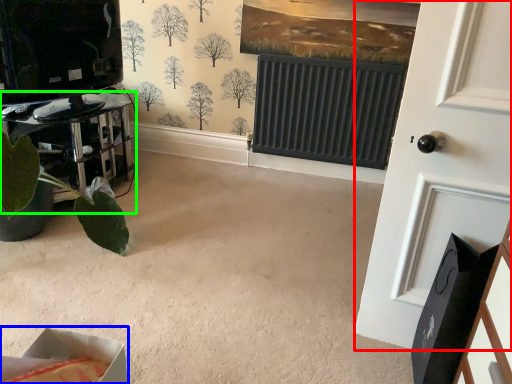
Question: Which is nearer to the door (highlighted by a red box)? cardboard box (highlighted by a blue box) or furniture (highlighted by a green box).

Choices:
 (A) cardboard box
 (B) furniture

Answer: (A)